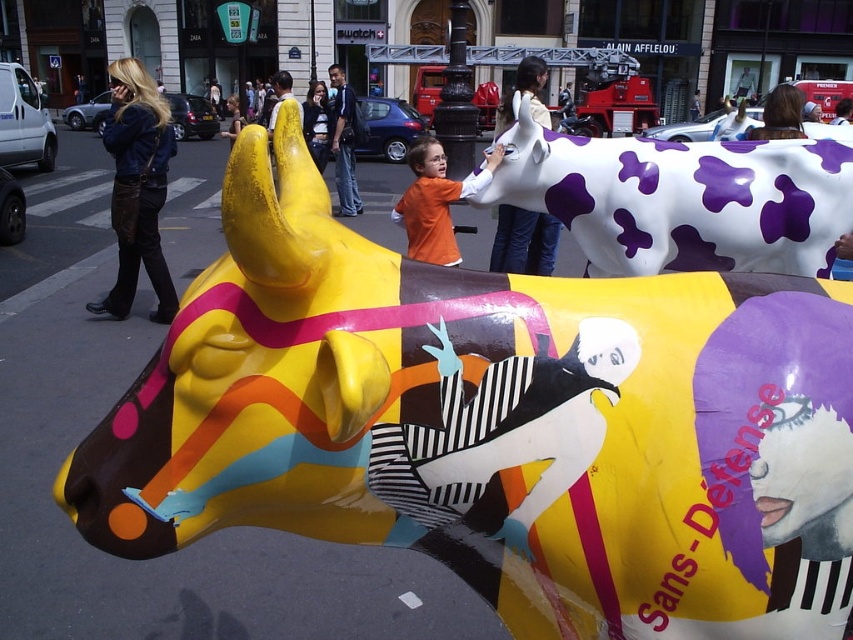
You are a photographer standing at the base of the yellow cow sculpture. You want to take a photo that includes both the orange matte shirt at center and the matte white shirt at upper center. Given that your camera has a maximum focus range of 6 feet, will you be able to capture both subjects in focus without moving closer?

The distance between the orange matte shirt at center and the matte white shirt at upper center is 6.42 feet. Since the camera can only focus up to 6 feet, the subjects are slightly out of the focus range. Therefore, you won exceed the camera focus limit and won capture both in focus without moving closer.

Please see the image. There is a point at coordinate (137, 188). Which object is closest to this point? The options are the yellow cow with abstract patterns and the white cow with purple spots.

The denim jacket at left is closest to the point at coordinate (137, 188).